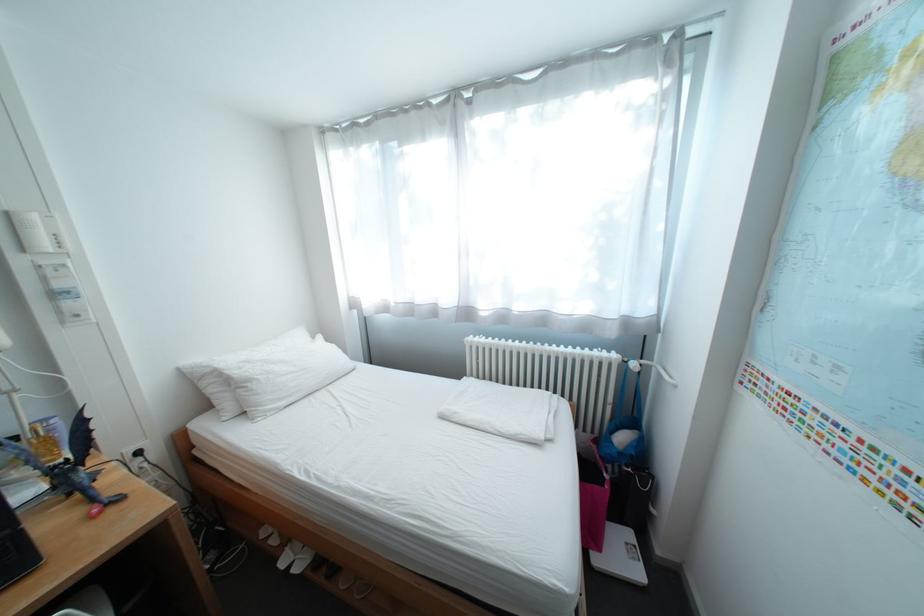
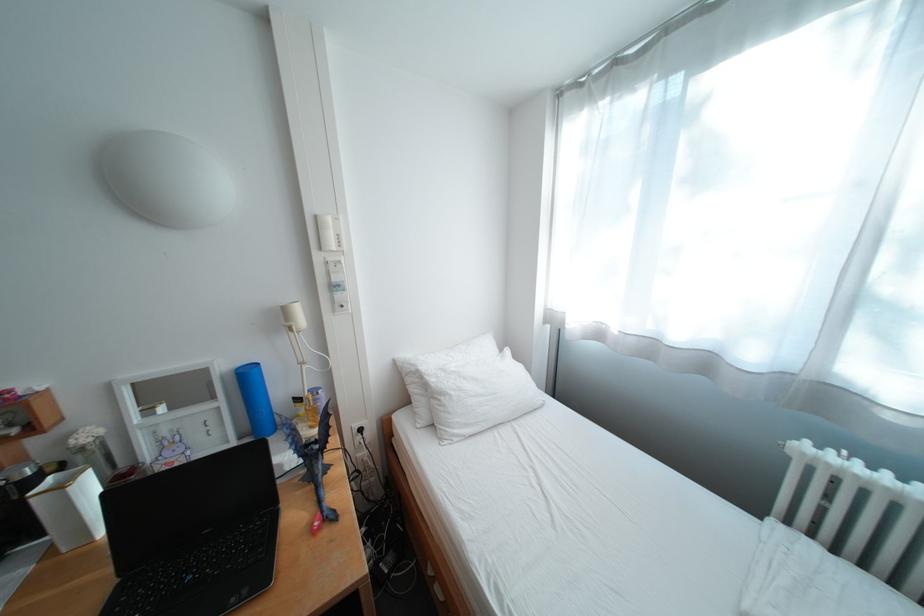
Question: The first image is from the beginning of the video and the second image is from the end. How did the camera likely rotate when shooting the video?

Choices:
 (A) Left
 (B) Right
 (C) Up
 (D) Down

Answer: (A)